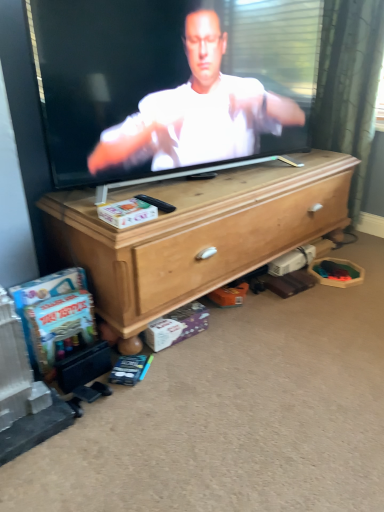
Question: Is black plastic remote control at center directly adjacent to wooden chest of drawers at center?

Choices:
 (A) no
 (B) yes

Answer: (A)

Question: Is black plastic remote control at center not inside wooden chest of drawers at center?

Choices:
 (A) no
 (B) yes

Answer: (B)

Question: Is black plastic remote control at center positioned behind wooden chest of drawers at center?

Choices:
 (A) yes
 (B) no

Answer: (A)

Question: Considering the relative positions of black plastic remote control at center and wooden chest of drawers at center in the image provided, is black plastic remote control at center to the right of wooden chest of drawers at center from the viewer's perspective?

Choices:
 (A) yes
 (B) no

Answer: (B)

Question: From a real-world perspective, is black plastic remote control at center under wooden chest of drawers at center?

Choices:
 (A) no
 (B) yes

Answer: (A)

Question: From the image's perspective, does black plastic remote control at center appear lower than wooden chest of drawers at center?

Choices:
 (A) no
 (B) yes

Answer: (A)

Question: Can you confirm if black plastic remote control at center is smaller than smooth white shirt at center?

Choices:
 (A) no
 (B) yes

Answer: (B)

Question: Can you confirm if black plastic remote control at center is wider than smooth white shirt at center?

Choices:
 (A) yes
 (B) no

Answer: (A)

Question: Is black plastic remote control at center closer to camera compared to smooth white shirt at center?

Choices:
 (A) yes
 (B) no

Answer: (B)

Question: Does black plastic remote control at center come behind smooth white shirt at center?

Choices:
 (A) no
 (B) yes

Answer: (B)

Question: Would you say black plastic remote control at center contains smooth white shirt at center?

Choices:
 (A) yes
 (B) no

Answer: (B)

Question: Is black plastic remote control at center bigger than smooth white shirt at center?

Choices:
 (A) yes
 (B) no

Answer: (B)

Question: From a real-world perspective, is wooden chest of drawers at center physically below black plastic remote control at center?

Choices:
 (A) yes
 (B) no

Answer: (A)